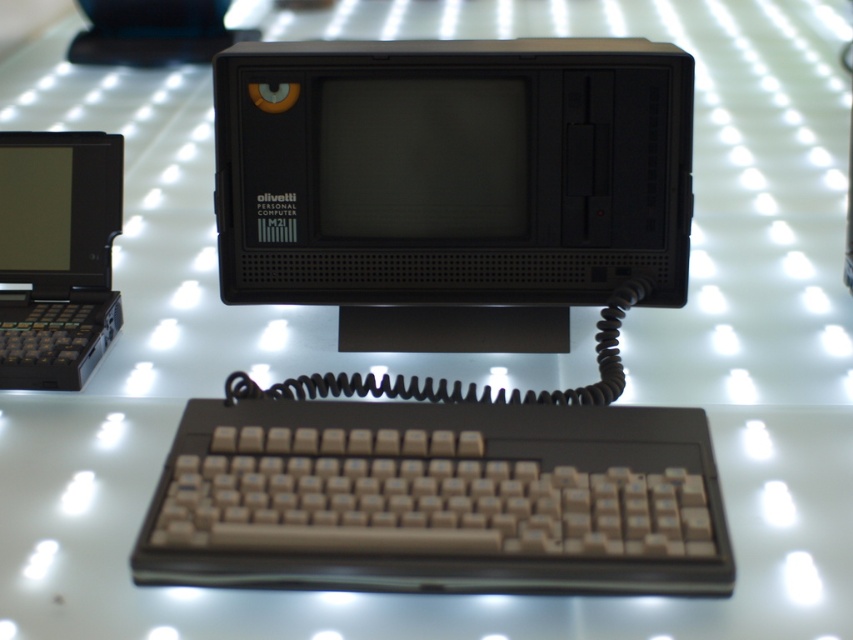
This screenshot has height=640, width=853. What do you see at coordinates (447, 301) in the screenshot?
I see `black plastic computer at center` at bounding box center [447, 301].

How distant is black plastic computer at center from black plastic laptop at left?

black plastic computer at center and black plastic laptop at left are 30.54 centimeters apart.

The width and height of the screenshot is (853, 640). I want to click on black plastic computer at center, so click(x=447, y=301).

Identify the location of beige plastic keyboard at center. The image size is (853, 640). (438, 499).

Is beige plastic keyboard at center positioned in front of black plastic laptop at left?

Yes, beige plastic keyboard at center is closer to the viewer.

Between point (572, 474) and point (57, 353), which one is positioned in front?

Point (572, 474)

Identify the location of beige plastic keyboard at center. (438, 499).

Does black plastic computer at center have a greater width compared to beige plastic keyboard at center?

Indeed, black plastic computer at center has a greater width compared to beige plastic keyboard at center.

Is black plastic computer at center above beige plastic keyboard at center?

Yes.

Who is more distant from viewer, (642, 182) or (223, 468)?

Positioned behind is point (642, 182).

This screenshot has width=853, height=640. I want to click on black plastic computer at center, so click(447, 301).